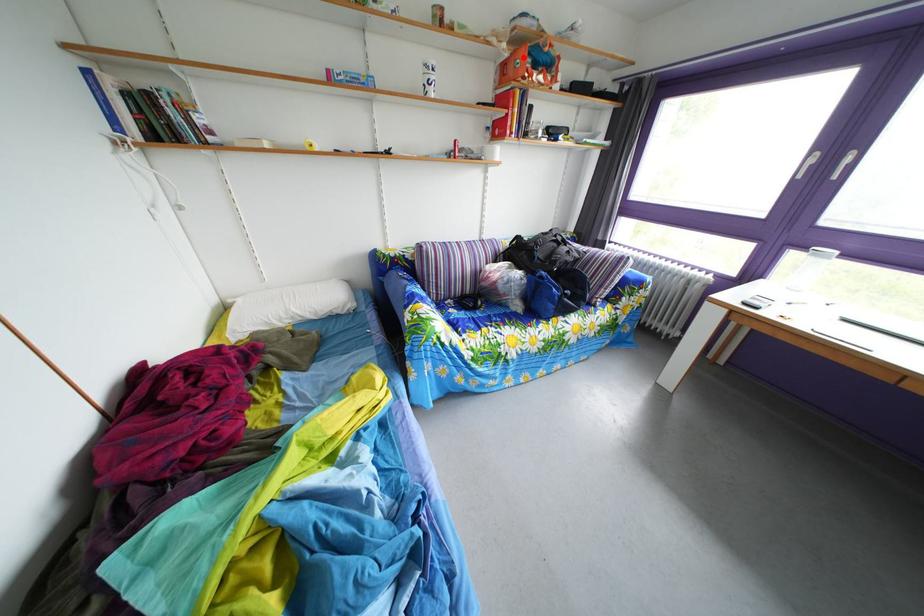
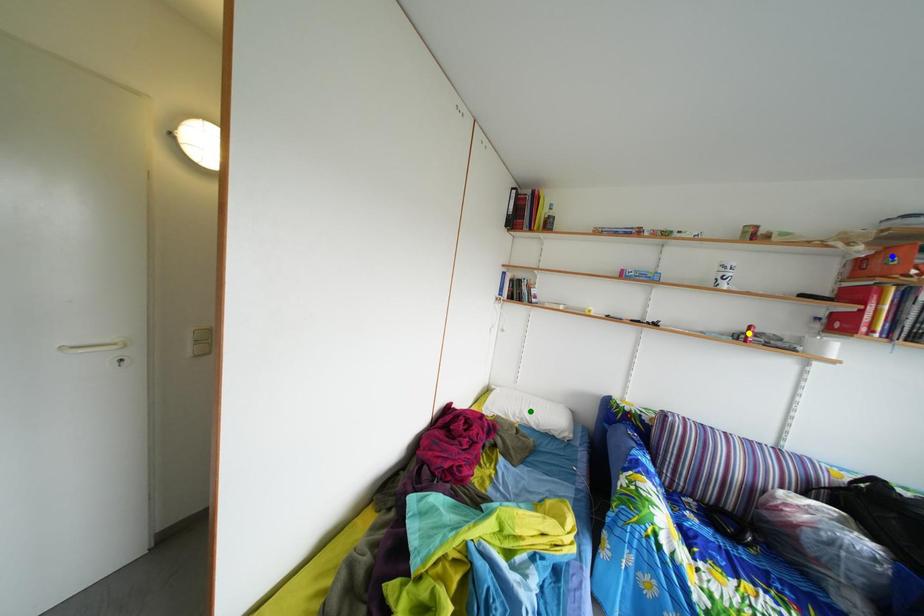
Question: I am providing you with two images of the same scene from different viewpoints. A red point is marked on the first image. You are given multiple points on the second image. In image 2, which mark is for the same physical point as the one in image 1?

Choices:
 (A) yellow point
 (B) blue point
 (C) green point

Answer: (B)